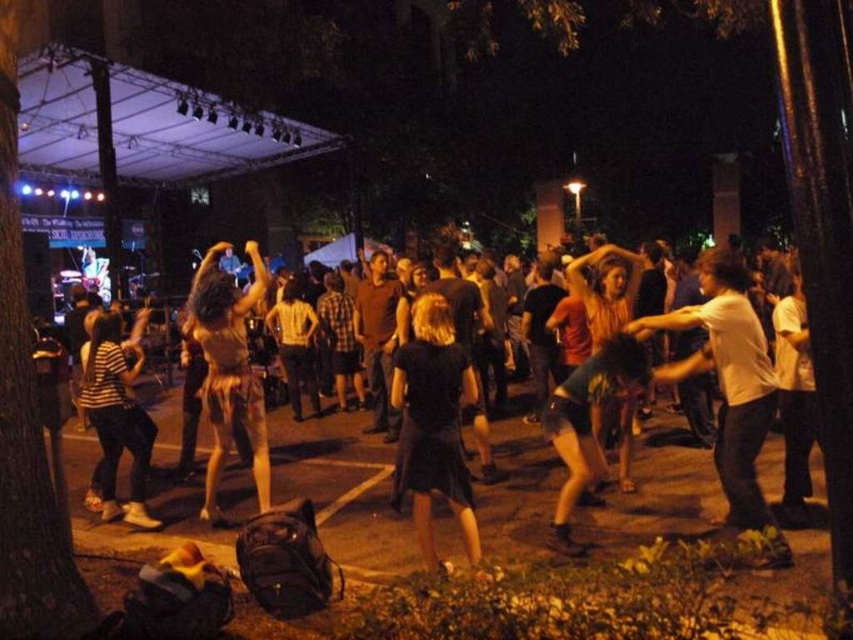
Question: Which of the following is the closest to the observer?

Choices:
 (A) (540, 468)
 (B) (727, 419)

Answer: (B)

Question: Which of these objects is positioned farthest from the white cotton shirt at right?

Choices:
 (A) striped cotton shirt at lower left
 (B) brown textured skirt at center
 (C) black cotton dress at center

Answer: (A)

Question: Is black cotton dress at center behind brown textured skirt at center?

Choices:
 (A) no
 (B) yes

Answer: (A)

Question: Considering the relative positions of brown textured skirt at center and striped cotton shirt at lower left in the image provided, where is brown textured skirt at center located with respect to striped cotton shirt at lower left?

Choices:
 (A) above
 (B) below

Answer: (A)

Question: Is black cotton dress at center in front of black matte skirt at center?

Choices:
 (A) no
 (B) yes

Answer: (A)

Question: Which object is positioned farthest from the white cotton shirt at right?

Choices:
 (A) brown textured skirt at center
 (B) black cotton dress at center
 (C) striped cotton shirt at lower left

Answer: (C)